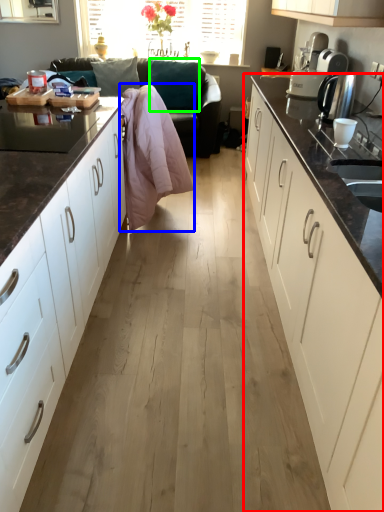
Question: Which object is positioned farthest from cabinetry (highlighted by a red box)? Select from blanket (highlighted by a blue box) and pillow (highlighted by a green box).

Choices:
 (A) blanket
 (B) pillow

Answer: (B)